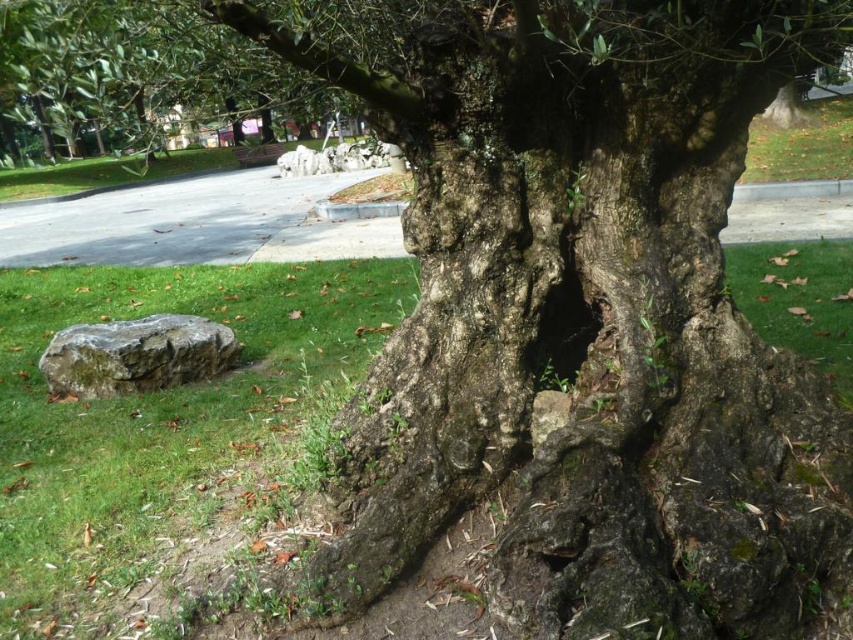
Which of these two, green mossy rock at lower left or dark rough hole at center, stands shorter?

With less height is dark rough hole at center.

Does point (132, 339) come behind point (573, 301)?

That is True.

Between point (210, 349) and point (532, 364), which one is positioned behind?

Point (210, 349)

The height and width of the screenshot is (640, 853). I want to click on green mossy rock at lower left, so click(135, 355).

Which is above, green grass at lower left or dark rough hole at center?

green grass at lower left is higher up.

Does green grass at lower left appear over dark rough hole at center?

Yes, green grass at lower left is above dark rough hole at center.

Locate an element on the screen. The height and width of the screenshot is (640, 853). green grass at lower left is located at coordinates (161, 424).

This screenshot has width=853, height=640. Identify the location of green grass at lower left. pyautogui.click(x=161, y=424).

Between green grass at lower left and green mossy rock at lower left, which one has less height?

green mossy rock at lower left

Is point (80, 440) behind point (206, 355)?

No, it is not.

Does point (248, 531) come in front of point (90, 397)?

Yes, point (248, 531) is closer to viewer.

I want to click on green grass at lower left, so click(161, 424).